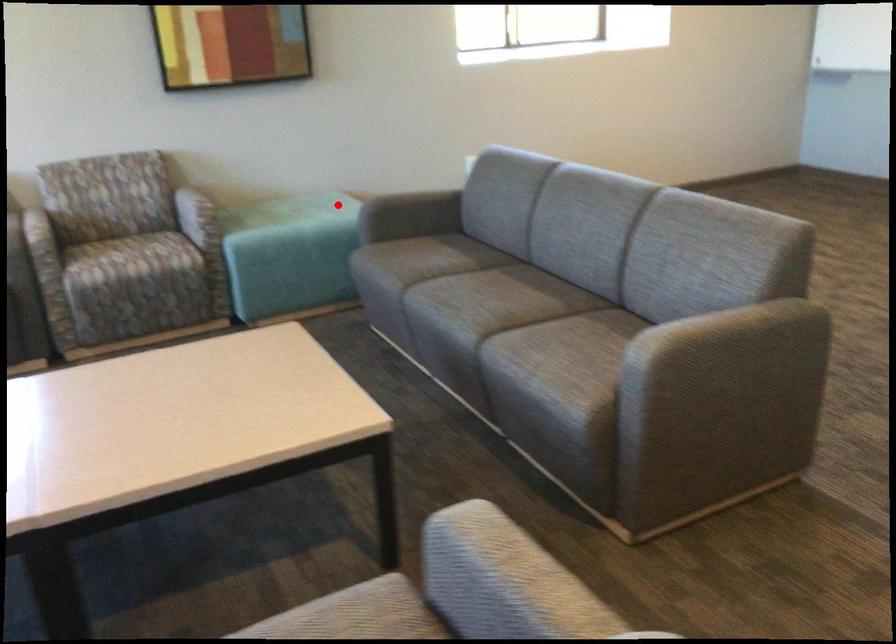
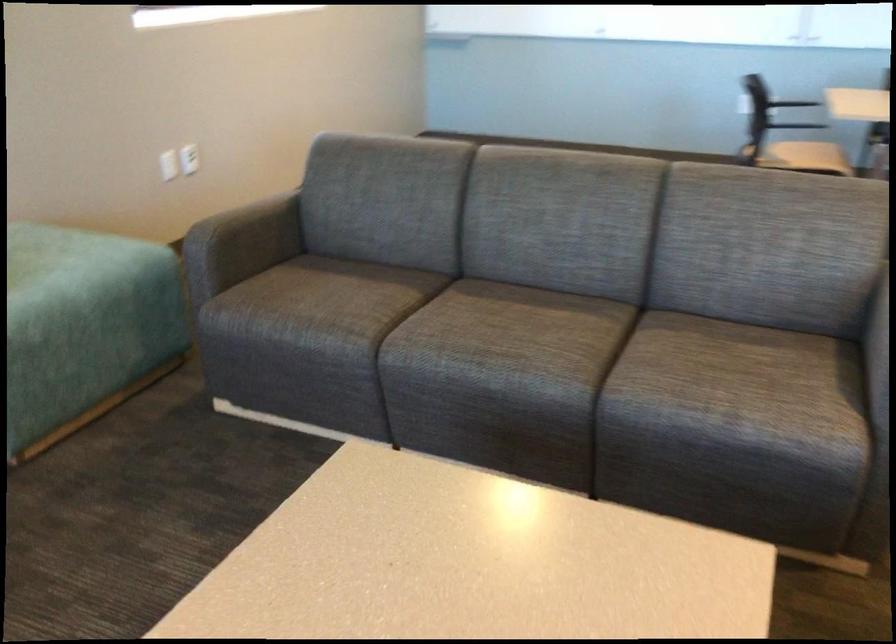
The point at the highlighted location is marked in the first image. Where is the corresponding point in the second image?

(56, 251)